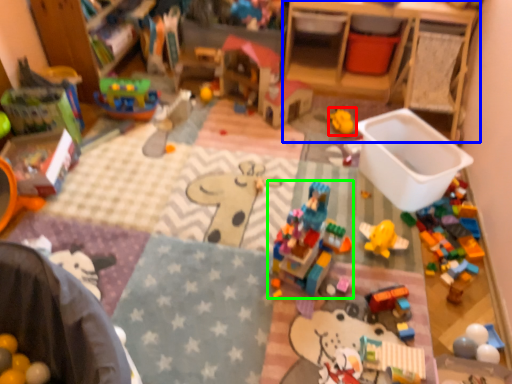
Question: Considering the real-world distances, which object is farthest from toy (highlighted by a red box)? changing table (highlighted by a blue box) or toy (highlighted by a green box)?

Choices:
 (A) changing table
 (B) toy

Answer: (B)